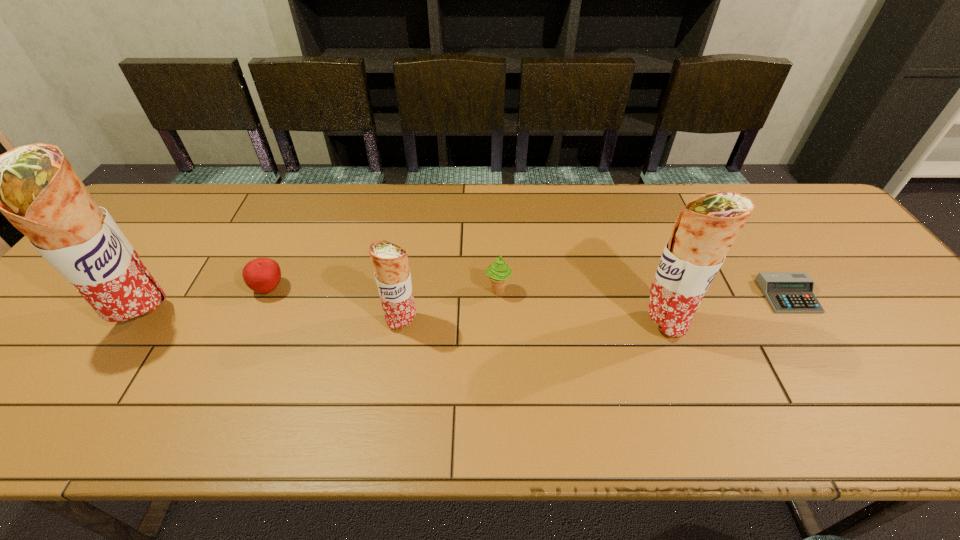
Considering the uniform spacing of burritos, where should an additional burrito be positioned on the right? Please locate a free spot. Please provide its 2D coordinates. Your answer should be formatted as a tuple, i.e. [(x, y)], where the tuple contains the x and y coordinates of a point satisfying the conditions above.

[(925, 327)]